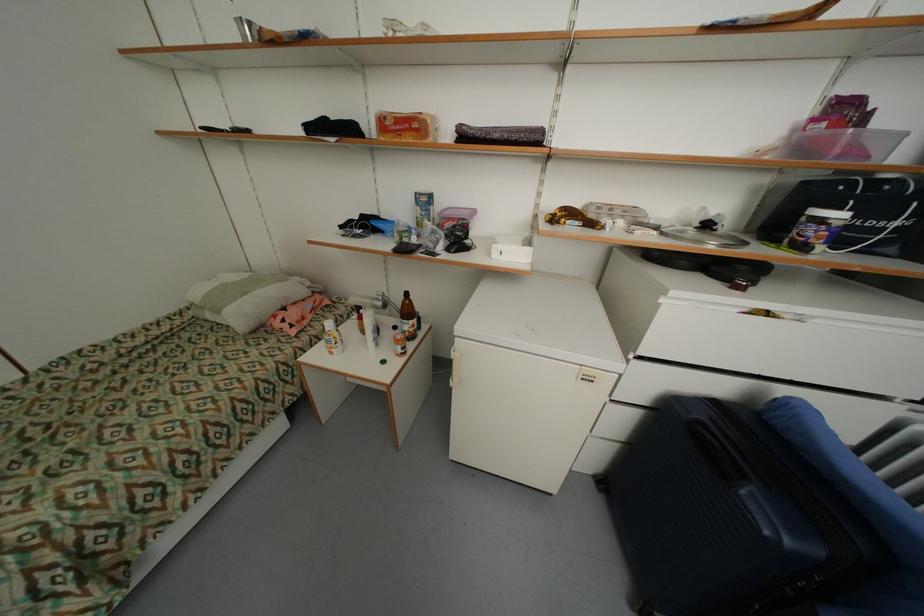
Identify the location of black pot lid handle. (708, 222).